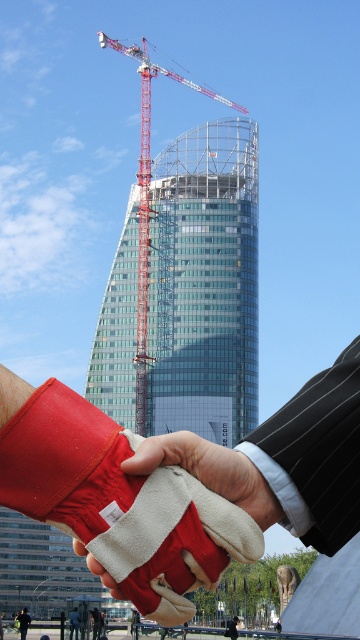
Does red leather glove at center come in front of red metal crane at center?

Yes, red leather glove at center is closer to the viewer.

Between red leather glove at center and red metal crane at center, which one is positioned higher?

red metal crane at center is higher up.

Locate an element on the screen. This screenshot has width=360, height=640. red leather glove at center is located at coordinates (210, 472).

Image resolution: width=360 pixels, height=640 pixels. Find the location of `red leather glove at center`. red leather glove at center is located at coordinates (210, 472).

Is red leather glove at center further to the viewer compared to red leather glove at lower left?

No, it is not.

What do you see at coordinates (210, 472) in the screenshot?
I see `red leather glove at center` at bounding box center [210, 472].

Image resolution: width=360 pixels, height=640 pixels. What do you see at coordinates (210, 472) in the screenshot?
I see `red leather glove at center` at bounding box center [210, 472].

Locate an element on the screen. red leather glove at center is located at coordinates (210, 472).

Can you confirm if red metal crane at center is taller than red leather glove at lower left?

Correct, red metal crane at center is much taller as red leather glove at lower left.

Locate an element on the screen. red metal crane at center is located at coordinates (147, 200).